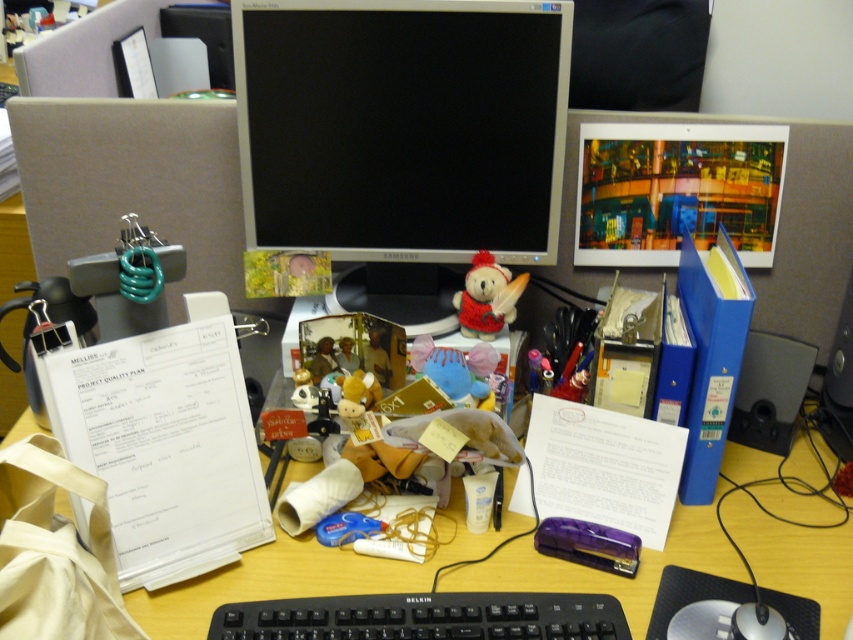
Question: Can you confirm if black glossy monitor at center is bigger than black plastic keyboard at center?

Choices:
 (A) yes
 (B) no

Answer: (A)

Question: Which point is closer to the camera taking this photo?

Choices:
 (A) (439, 67)
 (B) (229, 621)
 (C) (498, 280)

Answer: (B)

Question: Considering the relative positions of black glossy monitor at center and black plastic keyboard at center in the image provided, where is black glossy monitor at center located with respect to black plastic keyboard at center?

Choices:
 (A) right
 (B) left

Answer: (B)

Question: Can you confirm if black glossy monitor at center is wider than black plastic keyboard at center?

Choices:
 (A) yes
 (B) no

Answer: (A)

Question: Which of the following is the farthest from the observer?

Choices:
 (A) black plastic keyboard at center
 (B) black glossy monitor at center
 (C) red knitted teddy bear at center

Answer: (C)

Question: Which object is closer to the camera taking this photo?

Choices:
 (A) black plastic keyboard at center
 (B) fluffy yellow plush at center
 (C) black glossy monitor at center

Answer: (A)